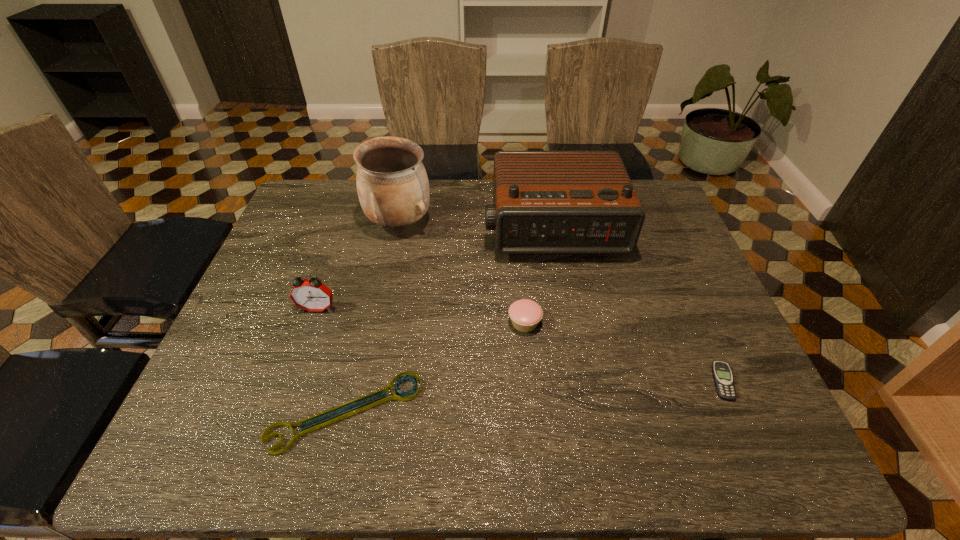
Locate an element on the screen. empty location between the urn and the wrench is located at coordinates (372, 318).

Point out which object is positioned as the fifth nearest to the wrench. Please provide its 2D coordinates. Your answer should be formatted as a tuple, i.e. [(x, y)], where the tuple contains the x and y coordinates of a point satisfying the conditions above.

[(722, 375)]

Identify which object is the closest to the beeper. Please provide its 2D coordinates. Your answer should be formatted as a tuple, i.e. [(x, y)], where the tuple contains the x and y coordinates of a point satisfying the conditions above.

[(545, 202)]

Find the location of a particular element. Image resolution: width=960 pixels, height=540 pixels. vacant region that satisfies the following two spatial constraints: 1. on the front side of the urn; 2. on the left side of the rightmost object is located at coordinates (366, 382).

This screenshot has width=960, height=540. I want to click on vacant space that satisfies the following two spatial constraints: 1. on the tuning display of the rightmost object; 2. on the left side of the fifth shortest object, so click(x=580, y=382).

This screenshot has width=960, height=540. I want to click on vacant position in the image that satisfies the following two spatial constraints: 1. on the tuning display of the rightmost object; 2. on the right side of the radio receiver, so click(580, 382).